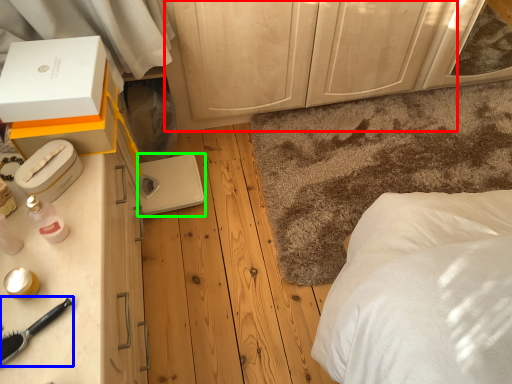
Question: Which object is the farthest from dresser (highlighted by a red box)? Choose among these: brush (highlighted by a blue box) or appliance (highlighted by a green box).

Choices:
 (A) brush
 (B) appliance

Answer: (A)